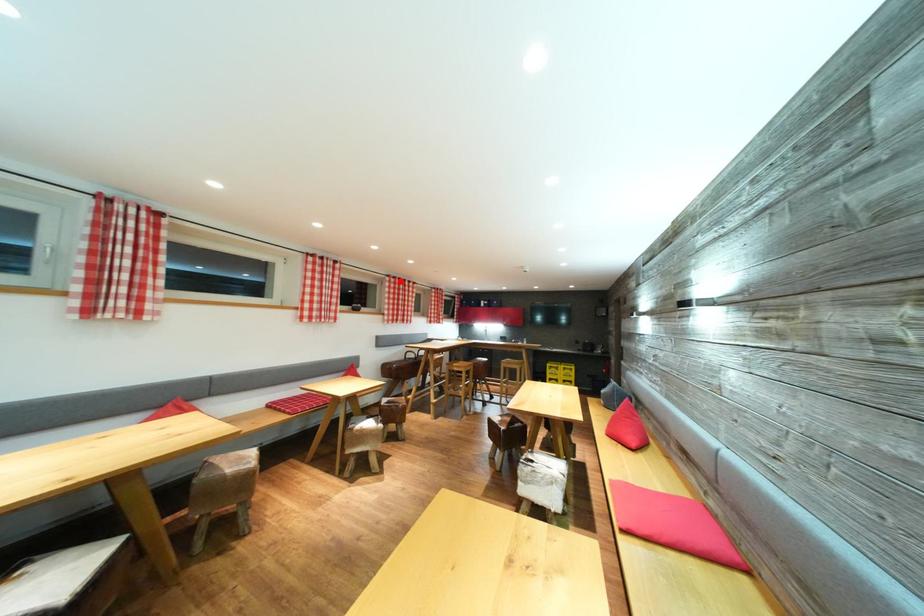
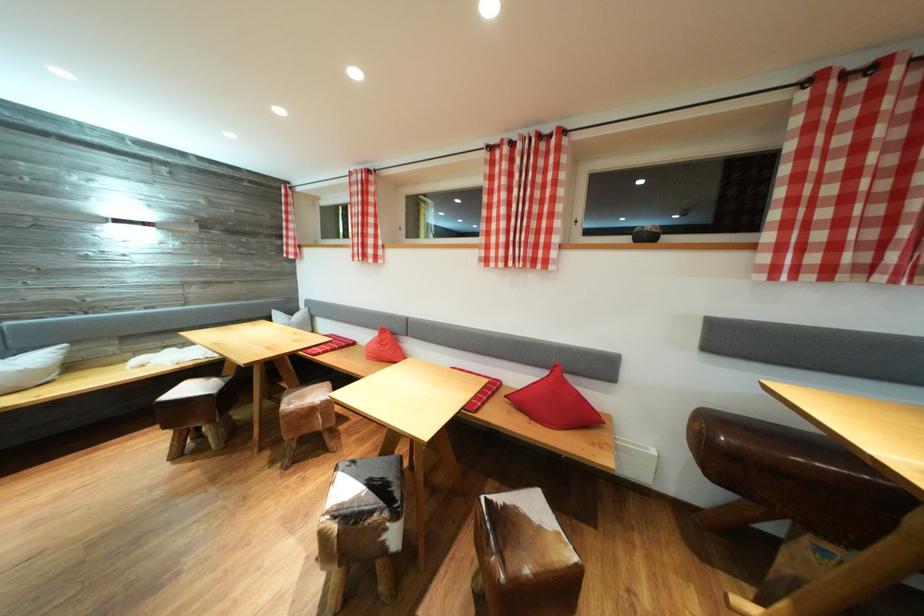
In the second image, find the point that corresponds to the highlighted location in the first image.

(869, 66)